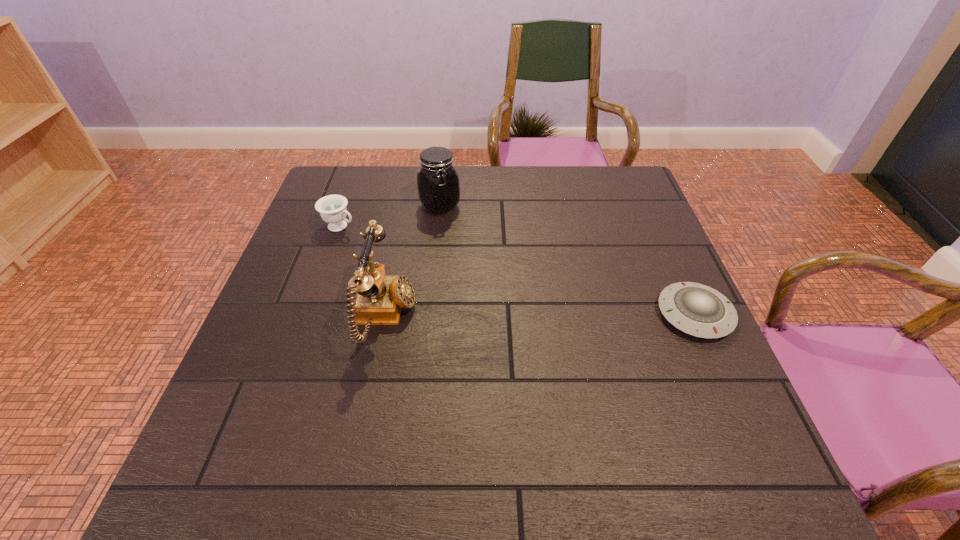
At what (x,y) coordinates should I click in order to perform the action: click on vacant space located on the side of the teacup with the handle. Please return your answer as a coordinate pair (x, y). The height and width of the screenshot is (540, 960). Looking at the image, I should click on (401, 254).

Identify the location of vacant space located 0.300m on the lid of the jar. The width and height of the screenshot is (960, 540). (525, 271).

This screenshot has width=960, height=540. I want to click on free space located on the lid of the jar, so coord(464,224).

This screenshot has width=960, height=540. I want to click on vacant space located 0.110m on the lid of the jar, so click(x=477, y=234).

Find the location of a particular element. This screenshot has width=960, height=540. object at the far edge is located at coordinates (438, 185).

I want to click on object located at the left edge, so click(x=332, y=208).

In order to click on object located in the right edge section of the desktop in this screenshot , I will do `click(696, 309)`.

Where is `vacant space at the far edge`? vacant space at the far edge is located at coordinates (414, 192).

Locate an element on the screen. The image size is (960, 540). vacant space at the near edge of the desktop is located at coordinates (554, 393).

At what (x,y) coordinates should I click in order to perform the action: click on vacant space at the left edge. Please return your answer as a coordinate pair (x, y). The width and height of the screenshot is (960, 540). Looking at the image, I should click on (270, 320).